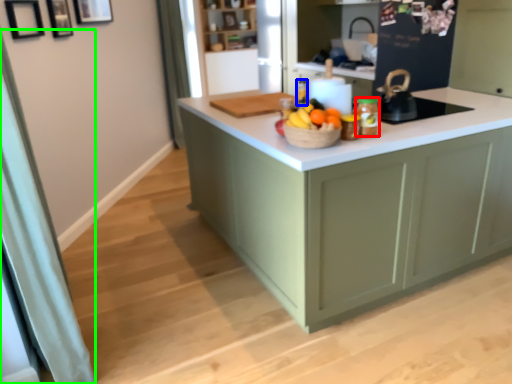
Question: Estimate the real-world distances between objects in this image. Which object is farther from kitchen appliance (highlighted by a red box), bottle (highlighted by a blue box) or curtain (highlighted by a green box)?

Choices:
 (A) bottle
 (B) curtain

Answer: (B)